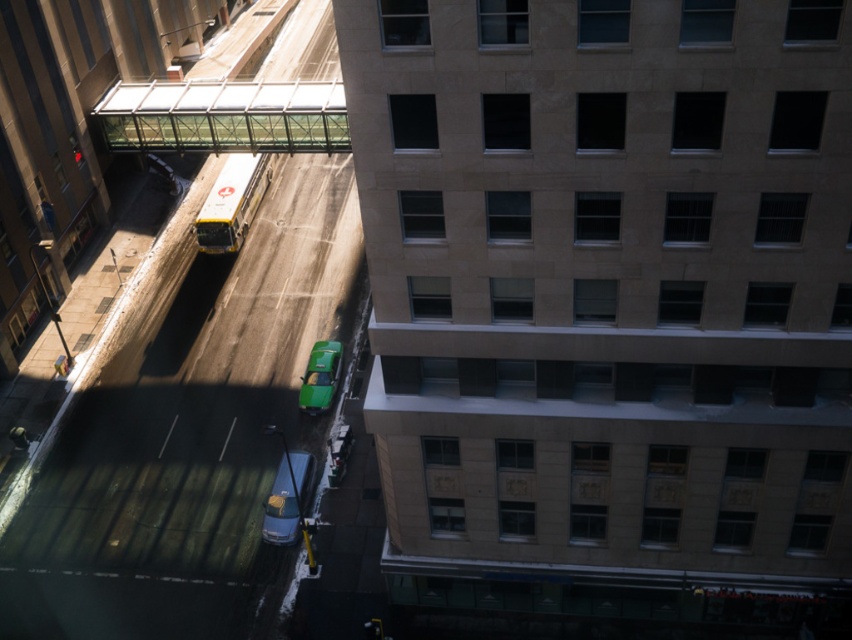
Question: Which point appears closest to the camera in this image?

Choices:
 (A) tap(327, 356)
 (B) tap(274, 529)
 (C) tap(225, 205)

Answer: (B)

Question: Is white glossy bus at center positioned in front of green matte taxi at center?

Choices:
 (A) no
 (B) yes

Answer: (A)

Question: Can you confirm if white glossy bus at center is thinner than green matte taxi at center?

Choices:
 (A) no
 (B) yes

Answer: (A)

Question: Which point is closer to the camera?

Choices:
 (A) (262, 525)
 (B) (315, 365)
 (C) (226, 227)

Answer: (A)

Question: Does metallic silver car at center appear on the left side of green matte taxi at center?

Choices:
 (A) no
 (B) yes

Answer: (B)

Question: Which object is positioned farthest from the white glossy bus at center?

Choices:
 (A) green matte taxi at center
 (B) metallic silver car at center

Answer: (B)